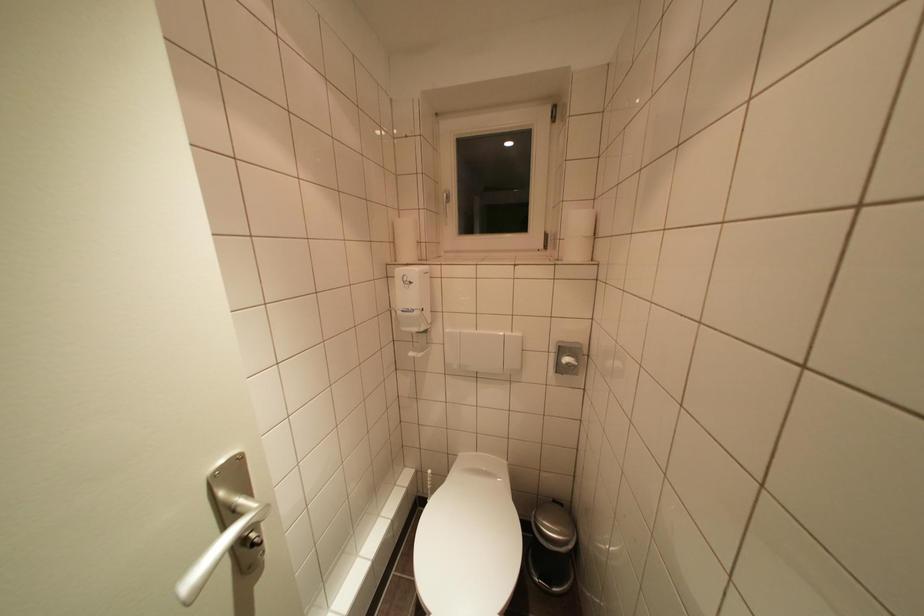
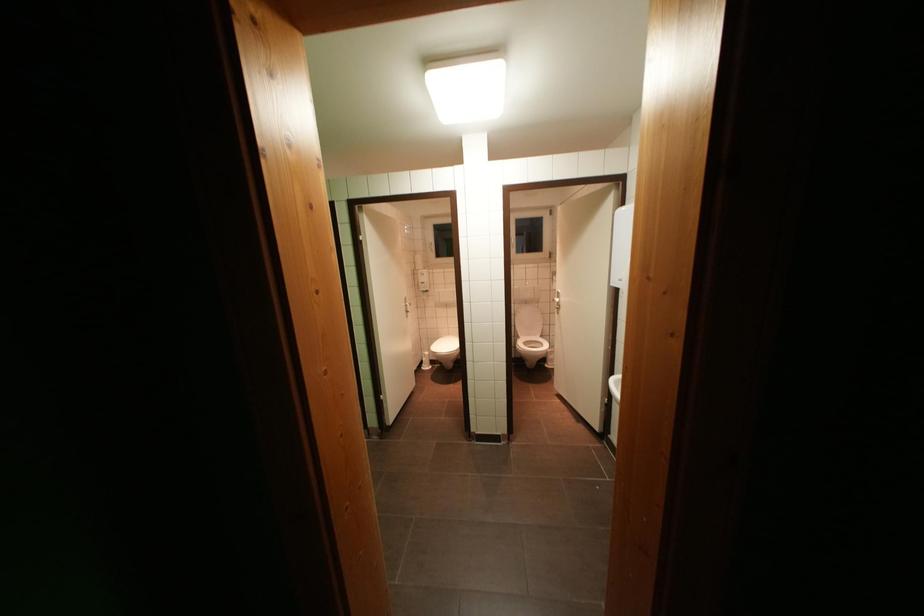
Question: What movement of the cameraman would produce the second image?

Choices:
 (A) Left
 (B) Right
 (C) Forward
 (D) Backward

Answer: (D)